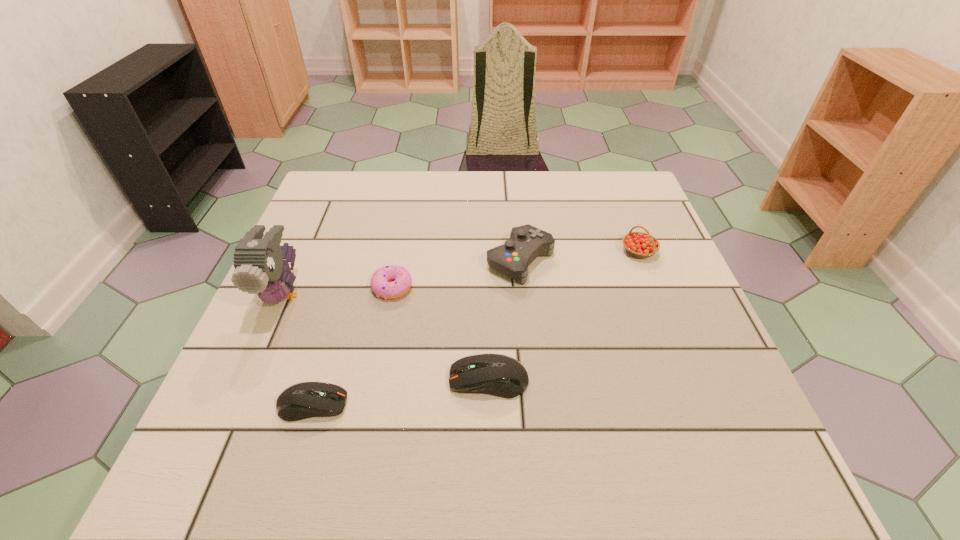
Locate an element on the screen. This screenshot has height=540, width=960. vacant space situated on the button of the taller computer equipment is located at coordinates (275, 380).

You are a GUI agent. You are given a task and a screenshot of the screen. Output one action in this format:
    pyautogui.click(x=<x>, y=<y>)
    Task: Click on the free space located on the button of the taller computer equipment
    
    Given the screenshot: What is the action you would take?
    pyautogui.click(x=300, y=380)

Identify the location of free space located on the front of the doughnut. The image size is (960, 540). (380, 345).

Identify the location of free space located 0.140m on the left of the rightmost object. The width and height of the screenshot is (960, 540). (564, 251).

What are the coordinates of `vacant region located 0.240m on the back of the control` in the screenshot? It's located at (514, 187).

I want to click on vacant space located 0.230m at the beak of the bird, so click(224, 427).

Locate an element on the screen. This screenshot has width=960, height=540. computer equipment located in the left edge section of the desktop is located at coordinates (304, 400).

At what (x,y) coordinates should I click in order to perform the action: click on bird present at the left edge. Please return your answer as a coordinate pair (x, y). The image size is (960, 540). Looking at the image, I should click on (260, 269).

This screenshot has width=960, height=540. I want to click on object present at the right edge, so click(x=638, y=244).

Find the location of a particular element. object located in the near left corner section of the desktop is located at coordinates [304, 400].